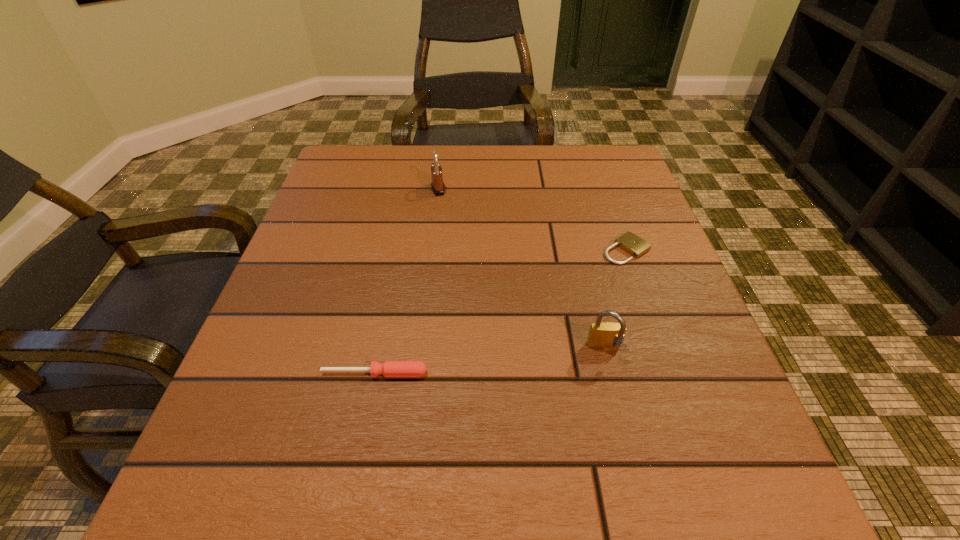
Identify the location of free space located on the right of the screwdriver. The width and height of the screenshot is (960, 540). (639, 373).

Locate an element on the screen. This screenshot has height=540, width=960. vacant space situated on the front of the shortest object is located at coordinates (680, 400).

Where is `object located in the far edge section of the desktop`? The height and width of the screenshot is (540, 960). object located in the far edge section of the desktop is located at coordinates (437, 185).

The height and width of the screenshot is (540, 960). Identify the location of object that is positioned at the left edge. (389, 368).

The image size is (960, 540). Find the location of `vacant space at the far edge of the desktop`. vacant space at the far edge of the desktop is located at coordinates (475, 170).

What are the coordinates of `vacant space at the near edge of the desktop` in the screenshot? It's located at (487, 503).

Find the location of `vacant point at the left edge`. vacant point at the left edge is located at coordinates (299, 411).

At what (x,y) coordinates should I click in order to perform the action: click on vacant space at the right edge of the desktop. Please return your answer as a coordinate pair (x, y). Image resolution: width=960 pixels, height=540 pixels. Looking at the image, I should click on (590, 205).

In the image, there is a desktop. Identify the location of vacant space at the far right corner. Image resolution: width=960 pixels, height=540 pixels. (601, 147).

Where is `free space at the near right corner of the desktop`? The width and height of the screenshot is (960, 540). free space at the near right corner of the desktop is located at coordinates (730, 474).